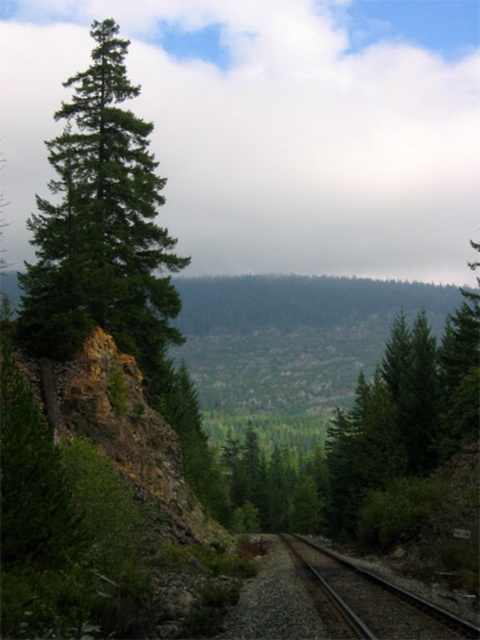
Question: Can you confirm if green matte tree at left is positioned above black metal train track at center?

Choices:
 (A) no
 (B) yes

Answer: (B)

Question: Among these points, which one is farthest from the camera?

Choices:
 (A) (81, 268)
 (B) (334, 586)

Answer: (A)

Question: Is green matte tree at left smaller than black metal train track at center?

Choices:
 (A) no
 (B) yes

Answer: (A)

Question: Can you confirm if green matte tree at left is positioned above black metal train track at center?

Choices:
 (A) yes
 (B) no

Answer: (A)